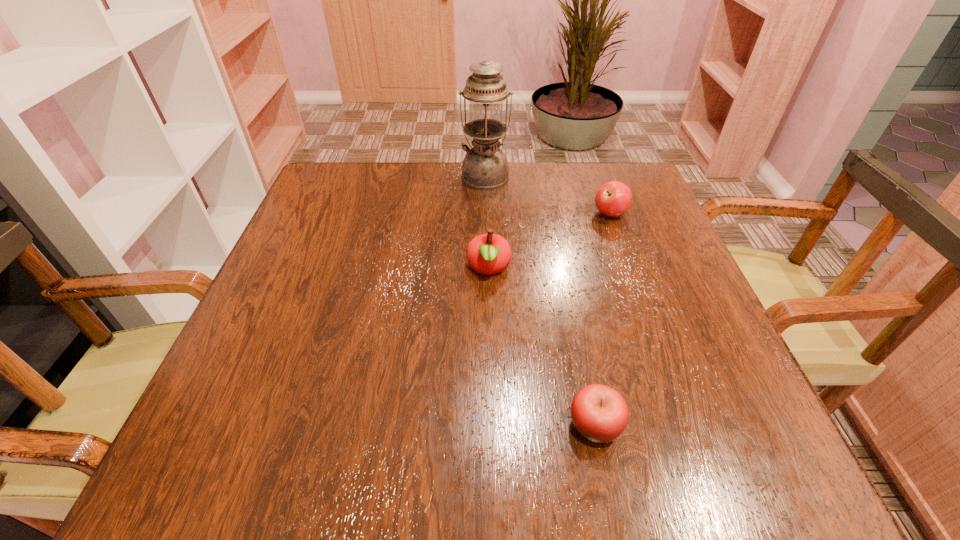
You are a GUI agent. You are given a task and a screenshot of the screen. Output one action in this format:
    pyautogui.click(x=<x>, y=<y>)
    Task: Click on the free space at the right edge of the desktop
    This screenshot has height=540, width=960.
    Given the screenshot: What is the action you would take?
    click(x=628, y=254)

This screenshot has height=540, width=960. Find the location of `free region at the near left corner of the desktop`. free region at the near left corner of the desktop is located at coordinates (285, 475).

In the image, there is a desktop. Where is `vacant space at the far right corner`? The height and width of the screenshot is (540, 960). vacant space at the far right corner is located at coordinates (632, 204).

You are a GUI agent. You are given a task and a screenshot of the screen. Output one action in this format:
    pyautogui.click(x=<x>, y=<y>)
    Task: Click on the free space at the near right corner
    
    Given the screenshot: What is the action you would take?
    pyautogui.click(x=715, y=433)

This screenshot has width=960, height=540. I want to click on vacant point located between the nearest apple and the second farthest object, so click(603, 320).

The image size is (960, 540). Identify the location of unoccupied position between the farthest object and the rightmost apple. (547, 195).

This screenshot has width=960, height=540. Find the location of `vacant area that lies between the leftmost apple and the second apple from right to left`. vacant area that lies between the leftmost apple and the second apple from right to left is located at coordinates (541, 347).

You are a GUI agent. You are given a task and a screenshot of the screen. Output one action in this format:
    pyautogui.click(x=<x>, y=<y>)
    Task: Click on the free space that is in between the oil lamp and the third farthest object
    This screenshot has width=960, height=540.
    Given the screenshot: What is the action you would take?
    pyautogui.click(x=487, y=222)

This screenshot has width=960, height=540. Identify the location of vacant space in between the nearest object and the third farthest object. (541, 347).

Identify the location of unoccupied area between the second farthest apple and the second apple from right to left. Image resolution: width=960 pixels, height=540 pixels. (541, 347).